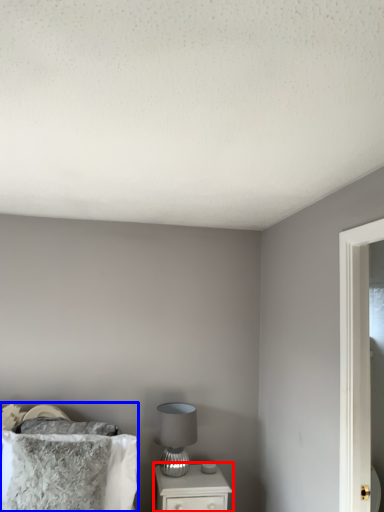
Question: Among these objects, which one is nearest to the camera, nightstand (highlighted by a red box) or bed (highlighted by a blue box)?

Choices:
 (A) nightstand
 (B) bed

Answer: (B)